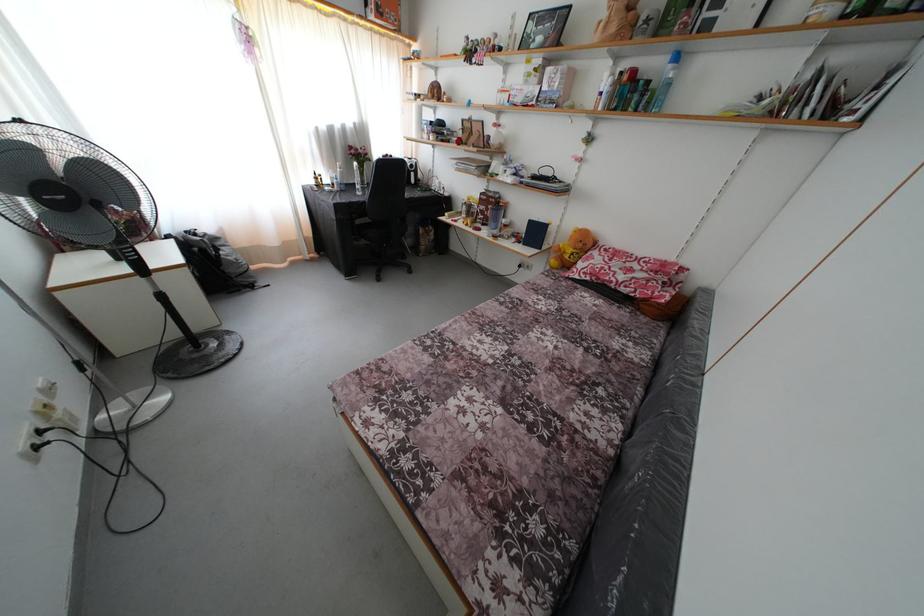
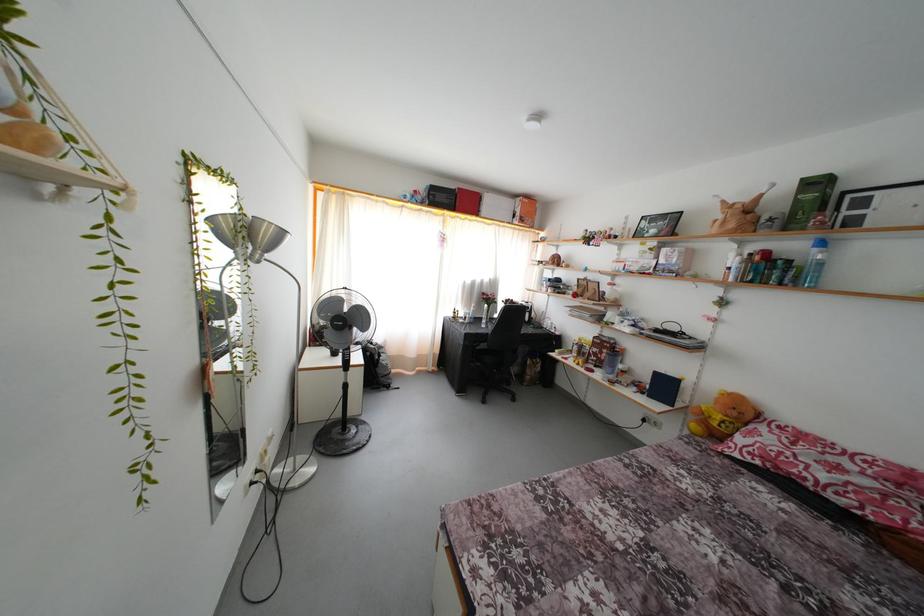
Based on the continuous images, in which direction is the camera rotating?

The camera rotated toward left-up.